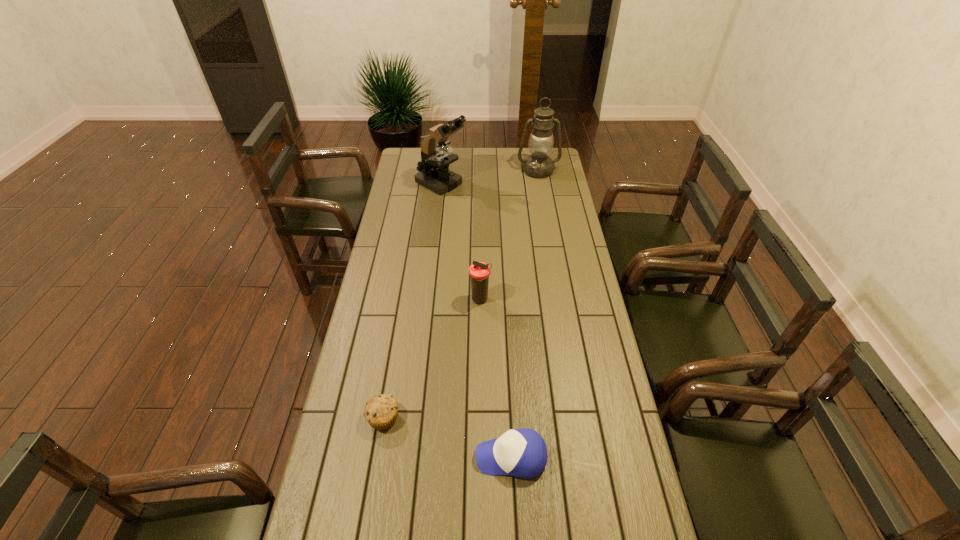
Image resolution: width=960 pixels, height=540 pixels. Find the location of `blank area at the far edge`. blank area at the far edge is located at coordinates (469, 150).

Locate an element on the screen. This screenshot has width=960, height=540. free space at the left edge of the desktop is located at coordinates (391, 305).

In the image, there is a desktop. Where is `free space at the right edge`? The height and width of the screenshot is (540, 960). free space at the right edge is located at coordinates (606, 353).

Find the location of a particular element. free space between the rightmost object and the third tallest object is located at coordinates (509, 235).

I want to click on free space between the thermos bottle and the microscope, so click(461, 241).

Locate an element on the screen. free space that is in between the microscope and the third nearest object is located at coordinates (461, 241).

This screenshot has width=960, height=540. What are the coordinates of `free space between the thermos bottle and the rightmost object` in the screenshot? It's located at (509, 235).

Identify the location of free space between the nearest object and the third tallest object. This screenshot has width=960, height=540. (495, 378).

You are a GUI agent. You are given a task and a screenshot of the screen. Output one action in this format:
    pyautogui.click(x=<x>, y=<y>)
    Task: Click on the free space between the third farthest object and the microscope
    
    Given the screenshot: What is the action you would take?
    pyautogui.click(x=461, y=241)

Locate an element on the screen. free space that is in between the muffin and the thermos bottle is located at coordinates (432, 359).